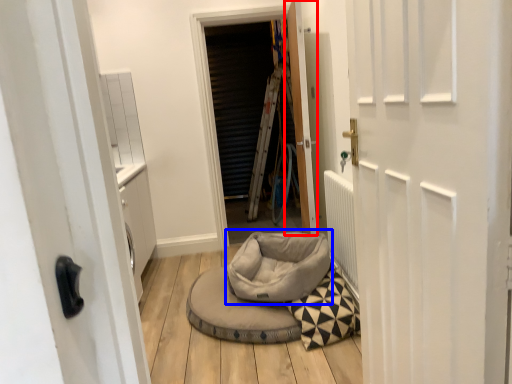
Question: Which of the following is the closest to the observer, door (highlighted by a red box) or bean bag chair (highlighted by a blue box)?

Choices:
 (A) door
 (B) bean bag chair

Answer: (B)